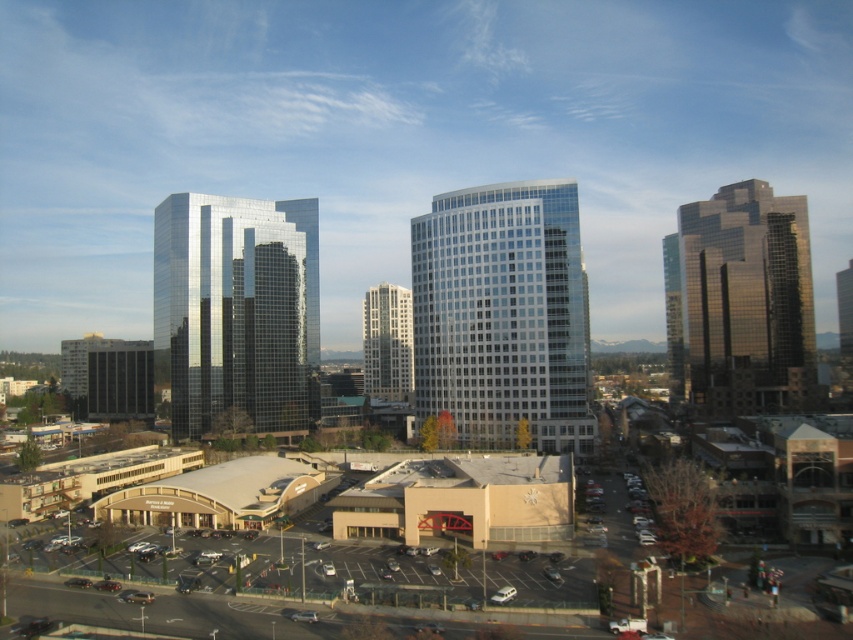
Question: Does clear glass building at center have a lesser width compared to glossy glass building at center-left?

Choices:
 (A) yes
 (B) no

Answer: (A)

Question: From the image, what is the correct spatial relationship of glossy glass building at center-left in relation to gold reflective glass building at right?

Choices:
 (A) left
 (B) right

Answer: (A)

Question: Is glossy glass building at center-left positioned before glassy reflective building at center?

Choices:
 (A) no
 (B) yes

Answer: (B)

Question: Estimate the real-world distances between objects in this image. Which object is farther from the clear glass building at center?

Choices:
 (A) glossy glass building at center-left
 (B) gold reflective glass building at right

Answer: (B)

Question: Based on their relative distances, which object is nearer to the glassy reflective building at center?

Choices:
 (A) gold reflective glass building at right
 (B) clear glass building at center

Answer: (B)

Question: Which is farther from the gold reflective glass building at right?

Choices:
 (A) clear glass building at center
 (B) glossy glass building at center-left
 (C) glassy reflective building at center

Answer: (B)